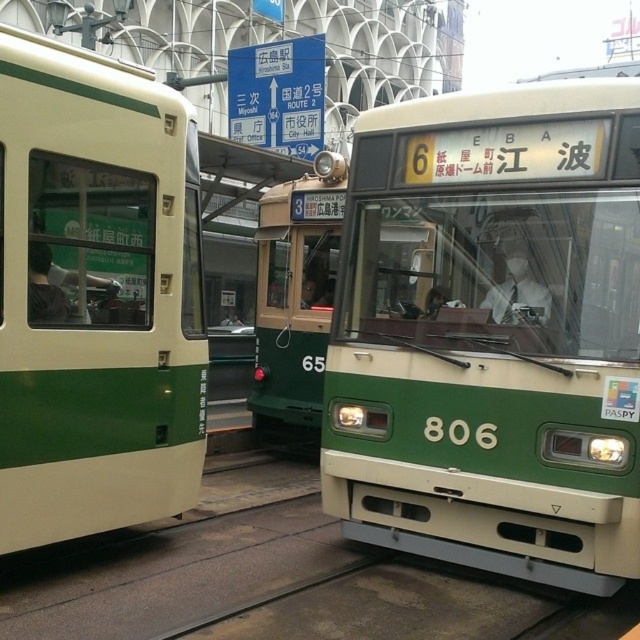
Question: Which point appears closest to the camera in this image?

Choices:
 (A) (548, 532)
 (B) (156, 147)
 (C) (259, 250)

Answer: (A)

Question: Which point is farther to the camera?

Choices:
 (A) green matte train at center
 (B) green matte train at left
 (C) green matte tram at center

Answer: (A)

Question: Does green matte train at left appear over green matte train at center?

Choices:
 (A) yes
 (B) no

Answer: (B)

Question: Where is green matte train at left located in relation to green matte train at center in the image?

Choices:
 (A) below
 (B) above

Answer: (A)

Question: Does green matte tram at center have a larger size compared to green matte train at center?

Choices:
 (A) no
 (B) yes

Answer: (B)

Question: Which point appears closest to the camera in this image?

Choices:
 (A) (454, 365)
 (B) (83, 422)
 (C) (301, 259)

Answer: (B)